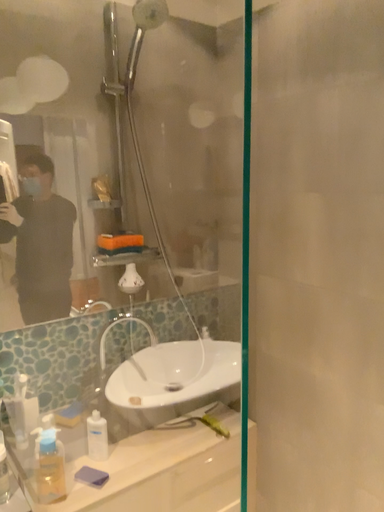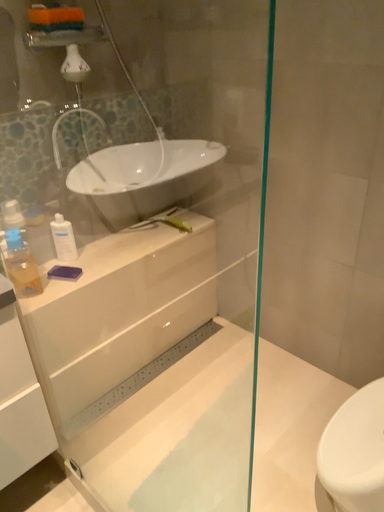
Question: How did the camera likely rotate when shooting the video?

Choices:
 (A) rotated downward
 (B) rotated upward

Answer: (A)